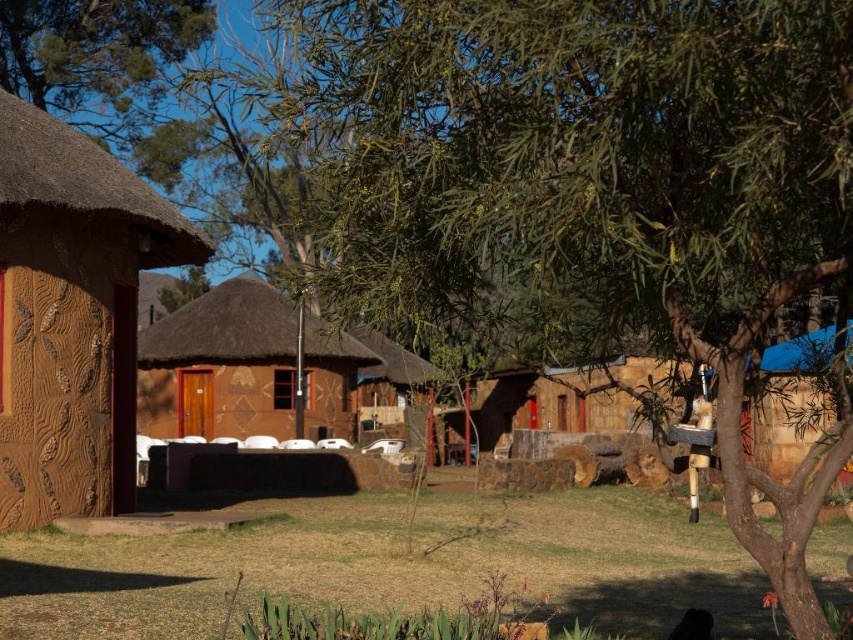
You are standing in the serene outdoor setting and want to sit down on the green grass at lower center. Is the brown textured hut at center blocking your path to the grass?

The green grass at lower center is below the brown textured hut at center, so the hut is blocking your path to the grass.

You are standing at the point marked as point (219, 364) in the image. Which object are you standing on?

You are standing on the brown thatched hut at center.

You are planning to take a photo of the brown textured hut at left and the brown thatched hut at center. Since you want both huts to be clearly visible in the photo, which hut should you position closer to the camera to ensure the one further away is still in focus?

The brown textured hut at left is in front of the brown thatched hut at center. To ensure both are clearly visible, position the brown textured hut at left closer to the camera so the one behind it remains in focus.